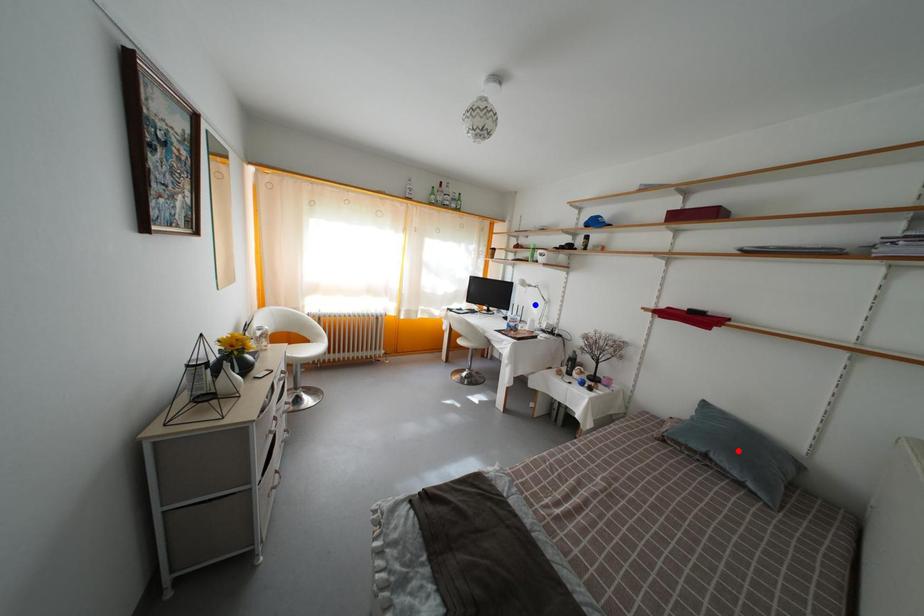
Question: Two points are marked on the image. Which point is closer to the camera?

Choices:
 (A) Blue point is closer.
 (B) Red point is closer.

Answer: (B)